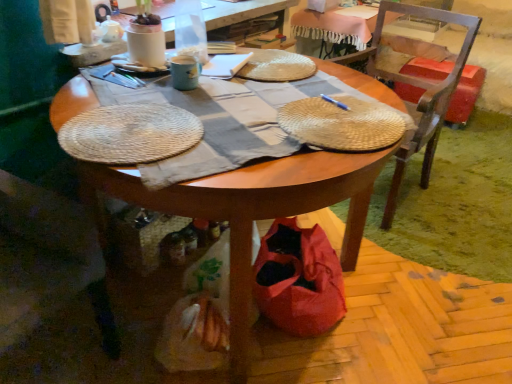
Locate an element on the screen. This screenshot has width=512, height=384. vacant region to the left of woven straw placemat at center is located at coordinates (236, 114).